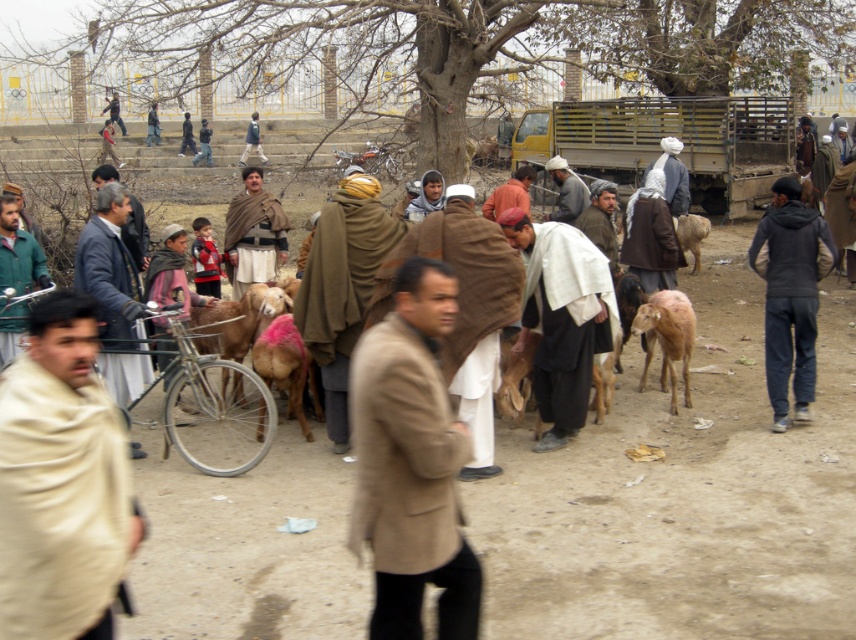
Can you confirm if beige woolen shawl at center is positioned below brown woolen coat at center?

Yes, beige woolen shawl at center is below brown woolen coat at center.

The width and height of the screenshot is (856, 640). In order to click on beige woolen shawl at center in this screenshot , I will do `click(61, 483)`.

Identify the location of beige woolen shawl at center. 61,483.

Based on the photo, between white woolen robe at center and brown woolen goat at center, which one has more height?

white woolen robe at center

Is point (572, 307) farther from camera compared to point (519, 380)?

No, (572, 307) is closer to viewer.

In the scene shown: Measure the distance between point (586, 369) and camera.

Point (586, 369) and camera are 7.21 meters apart.

Locate an element on the screen. The image size is (856, 640). white woolen robe at center is located at coordinates (562, 317).

Which is behind, point (76, 280) or point (289, 412)?

Positioned behind is point (289, 412).

Measure the distance between point [111,252] and camera.

Point [111,252] is 7.08 meters from camera.

Where is `light brown woolen coat at center`? Image resolution: width=856 pixels, height=640 pixels. light brown woolen coat at center is located at coordinates (111, 291).